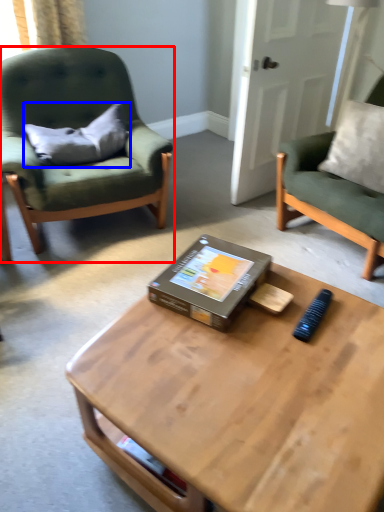
Question: Which object is further to the camera taking this photo, chair (highlighted by a red box) or pillow (highlighted by a blue box)?

Choices:
 (A) chair
 (B) pillow

Answer: (B)